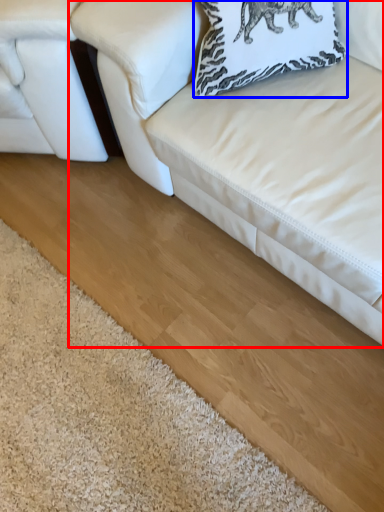
Question: Which object appears farthest to the camera in this image, studio couch (highlighted by a red box) or pillow (highlighted by a blue box)?

Choices:
 (A) studio couch
 (B) pillow

Answer: (B)